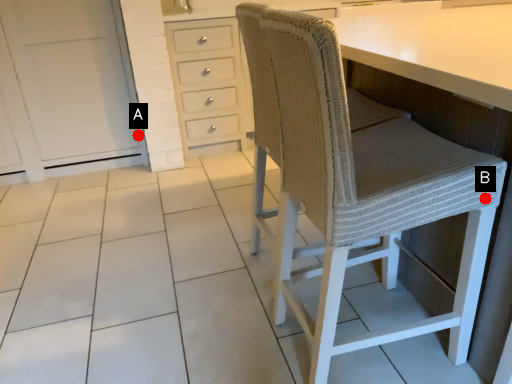
Question: Two points are circled on the image, labeled by A and B beside each circle. Which point appears closest to the camera in this image?

Choices:
 (A) A is closer
 (B) B is closer

Answer: (B)